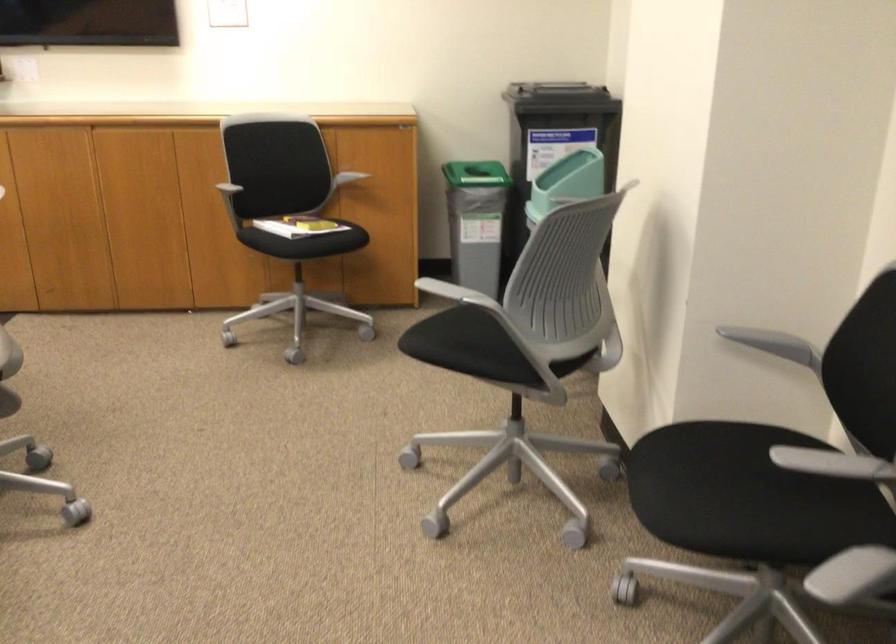
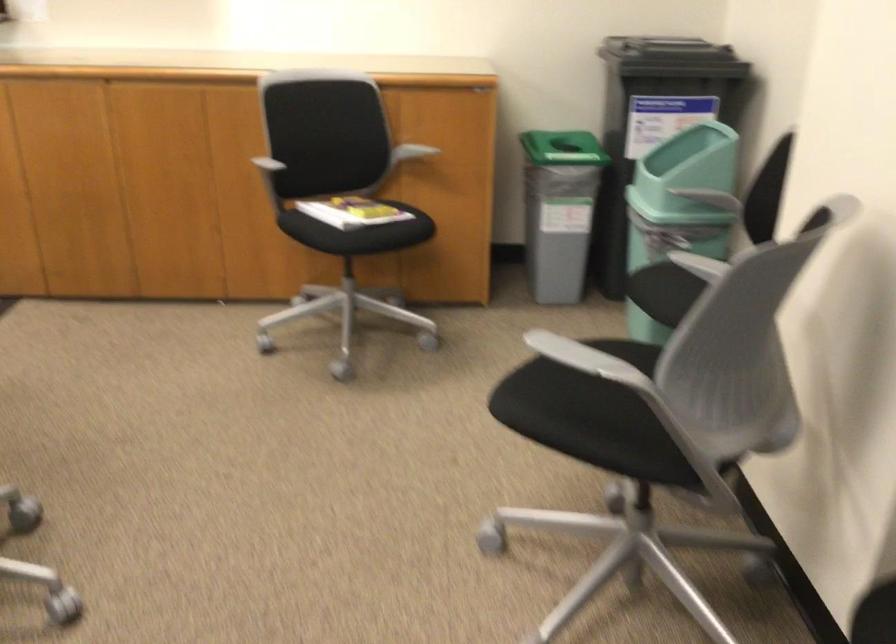
The point at (348, 176) is marked in the first image. Where is the corresponding point in the second image?

(409, 152)